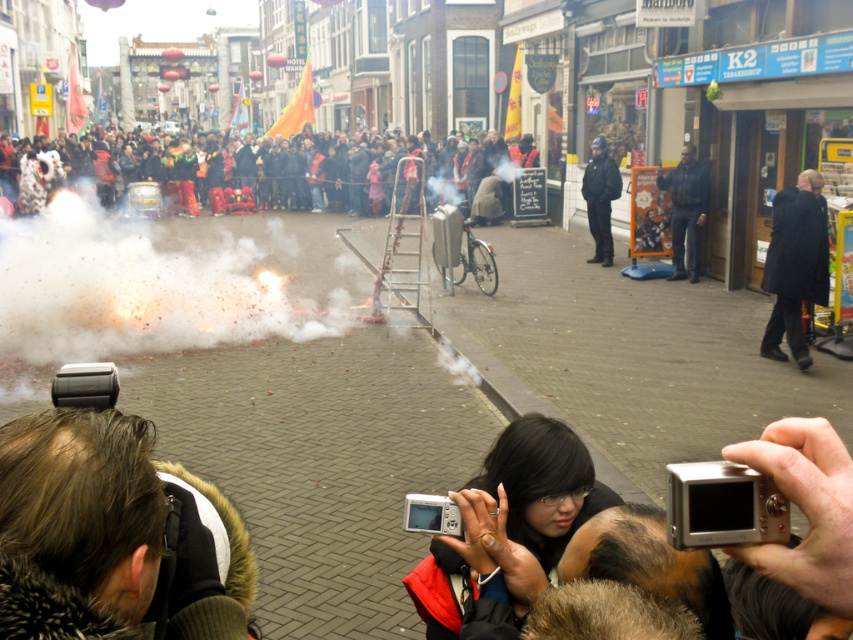
Question: Can you confirm if dark blue jacket at center is positioned below dark clothing crowd at center?

Choices:
 (A) yes
 (B) no

Answer: (A)

Question: Which object is positioned farthest from the black uniformed officer at center?

Choices:
 (A) dark clothing crowd at center
 (B) dark wool coat at right

Answer: (A)

Question: Which of the following is the closest to the observer?

Choices:
 (A) tap(611, 241)
 (B) tap(695, 160)

Answer: (B)

Question: Is dark wool coat at right to the right of dark blue jacket at center from the viewer's perspective?

Choices:
 (A) no
 (B) yes

Answer: (A)

Question: Which of these objects is positioned farthest from the dark blue jacket at center?

Choices:
 (A) black uniformed officer at center
 (B) dark clothing crowd at center

Answer: (B)

Question: Can you confirm if black uniformed officer at center is wider than dark clothing crowd at center?

Choices:
 (A) yes
 (B) no

Answer: (B)